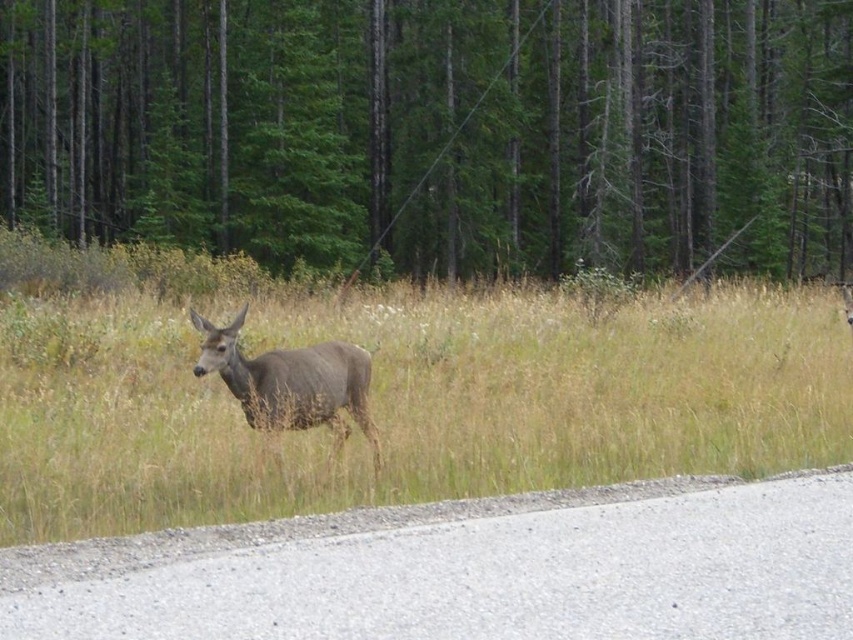
Who is higher up, brown grass at center or brown matte deer at center?

brown grass at center

Which is behind, point (534, 410) or point (277, 371)?

The point (534, 410) is behind.

You are a GUI agent. You are given a task and a screenshot of the screen. Output one action in this format:
    pyautogui.click(x=<x>, y=<y>)
    Task: Click on the brown grass at center
    The height and width of the screenshot is (640, 853).
    Given the screenshot: What is the action you would take?
    [x=412, y=403]

Where is `brown grass at center`? This screenshot has width=853, height=640. brown grass at center is located at coordinates (412, 403).

I want to click on green matte tree at center, so click(434, 129).

Looking at this image, is green matte tree at center bigger than brown matte deer at center?

Indeed, green matte tree at center has a larger size compared to brown matte deer at center.

Who is more forward, (103, 234) or (357, 376)?

Point (357, 376) is more forward.

You are a GUI agent. You are given a task and a screenshot of the screen. Output one action in this format:
    pyautogui.click(x=<x>, y=<y>)
    Task: Click on the green matte tree at center
    
    Given the screenshot: What is the action you would take?
    coord(434,129)

Is green matte tree at center below brown grass at center?

Incorrect, green matte tree at center is not positioned below brown grass at center.

Does green matte tree at center have a lesser height compared to brown grass at center?

Incorrect, green matte tree at center's height does not fall short of brown grass at center's.

Where is `green matte tree at center`? This screenshot has width=853, height=640. green matte tree at center is located at coordinates (434, 129).